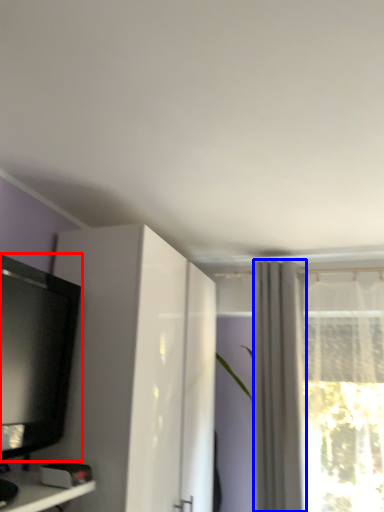
Question: Which object appears closest to the camera in this image, television (highlighted by a red box) or curtain (highlighted by a blue box)?

Choices:
 (A) television
 (B) curtain

Answer: (A)